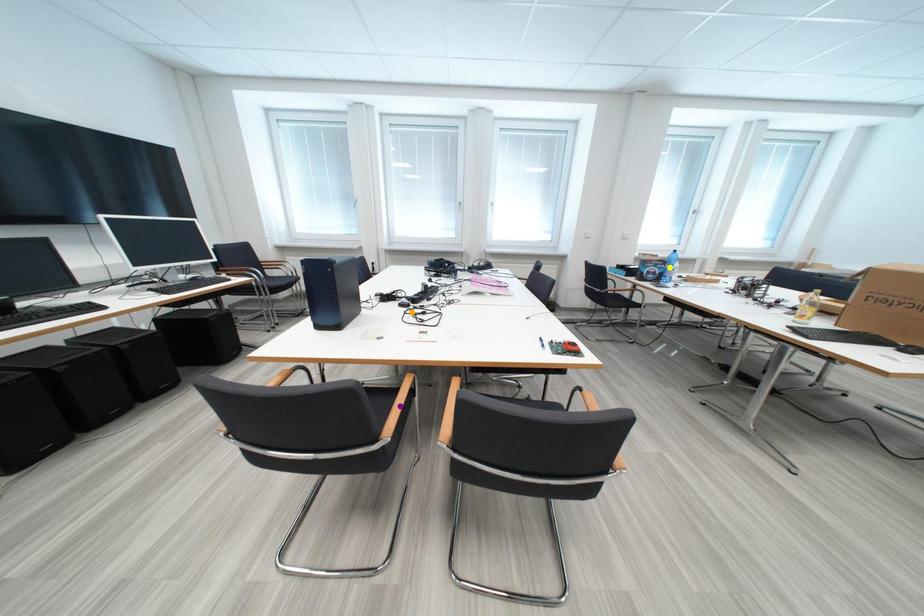
Order these from nearest to farthest:
1. yellow point
2. orange point
3. purple point

purple point, orange point, yellow point